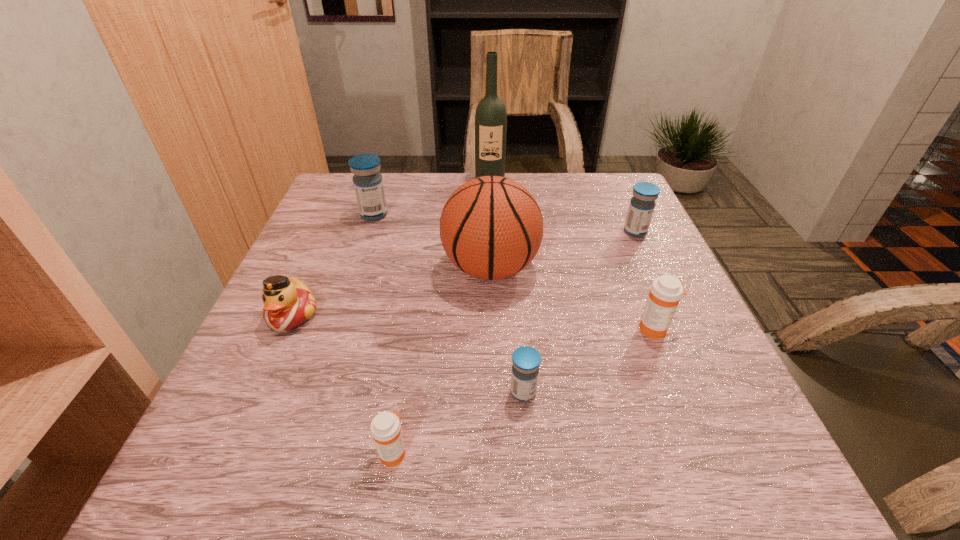
This screenshot has height=540, width=960. Identify the location of blank area located on the right of the sixth shortest object. coord(474,214).

Find the location of a particular element. The height and width of the screenshot is (540, 960). vacant point located 0.060m on the back of the farther orange medicine is located at coordinates (642, 297).

This screenshot has height=540, width=960. Identify the location of free spot located on the left of the second smallest blue medicine. (578, 232).

Locate an element on the screen. Image resolution: width=960 pixels, height=540 pixels. vacant space located 0.280m on the face of the leftmost object is located at coordinates (214, 492).

The height and width of the screenshot is (540, 960). Find the location of `free space located on the back of the left orange medicine`. free space located on the back of the left orange medicine is located at coordinates (401, 398).

Find the location of a particular element. The image size is (960, 540). free point located on the left of the second nearest medicine is located at coordinates (316, 392).

Where is `wine bottle that is positioned at the far edge`? wine bottle that is positioned at the far edge is located at coordinates (490, 117).

Locate an element on the screen. medicine that is positioned at the far edge is located at coordinates (368, 184).

This screenshot has width=960, height=540. What are the coordinates of `object situated at the near edge` in the screenshot? It's located at tap(385, 428).

At what (x,y) coordinates should I click in order to perform the action: click on medicine at the left edge. Please return your answer as a coordinate pair (x, y). The width and height of the screenshot is (960, 540). Looking at the image, I should click on (368, 184).